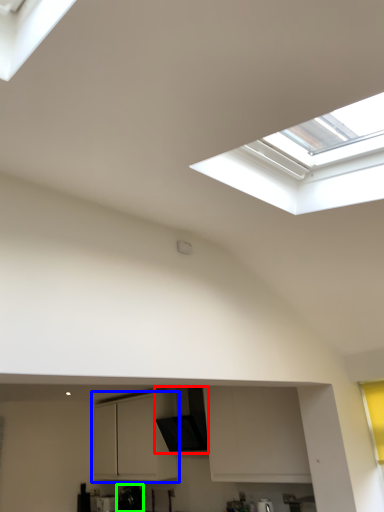
Question: Which is nearer to the exhaust hood (highlighted by a red box)? cabinetry (highlighted by a blue box) or appliance (highlighted by a green box).

Choices:
 (A) cabinetry
 (B) appliance

Answer: (A)